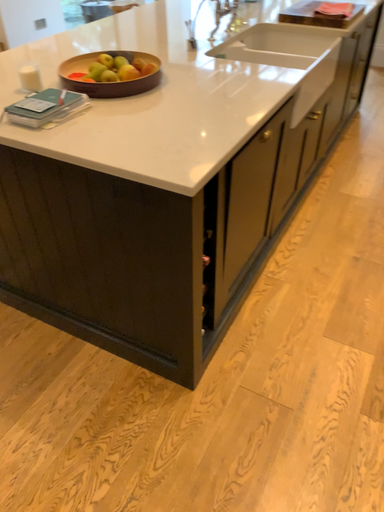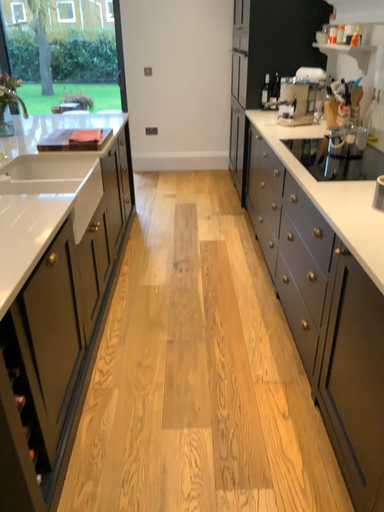
Question: Which way did the camera rotate in the video?

Choices:
 (A) rotated right
 (B) rotated left

Answer: (A)